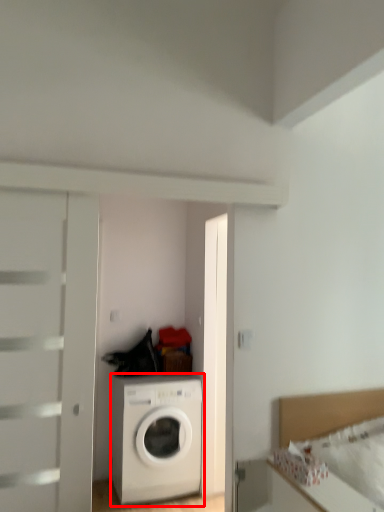
Question: From the image's perspective, what is the correct spatial positioning of washing machine (annotated by the red box) in reference to bed?

Choices:
 (A) below
 (B) above

Answer: (A)